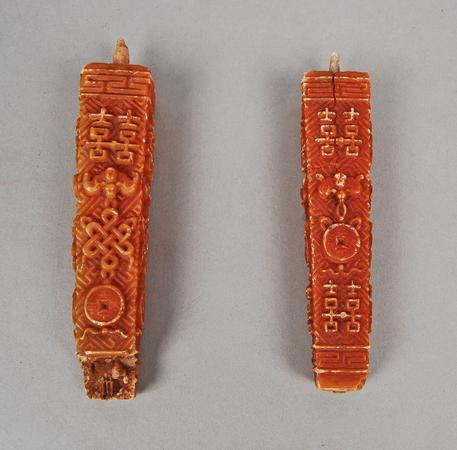
Identify the location of patterned orange candle. Image resolution: width=457 pixels, height=450 pixels. (79, 330).